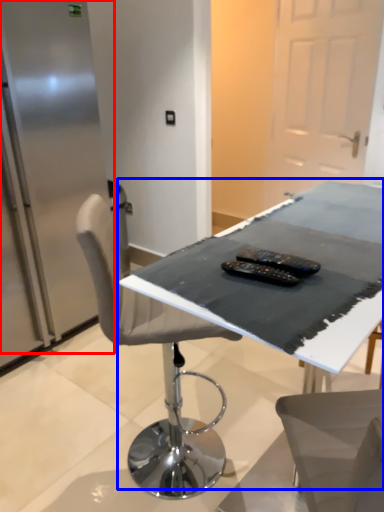
Question: Which of the following is the farthest to the observer, fridge (highlighted by a red box) or table (highlighted by a blue box)?

Choices:
 (A) fridge
 (B) table

Answer: (A)